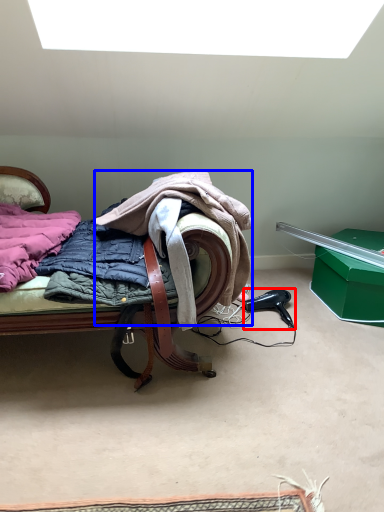
Question: Which point is closer to the camera, hair drier (highlighted by a red box) or cloak (highlighted by a blue box)?

Choices:
 (A) hair drier
 (B) cloak

Answer: (B)